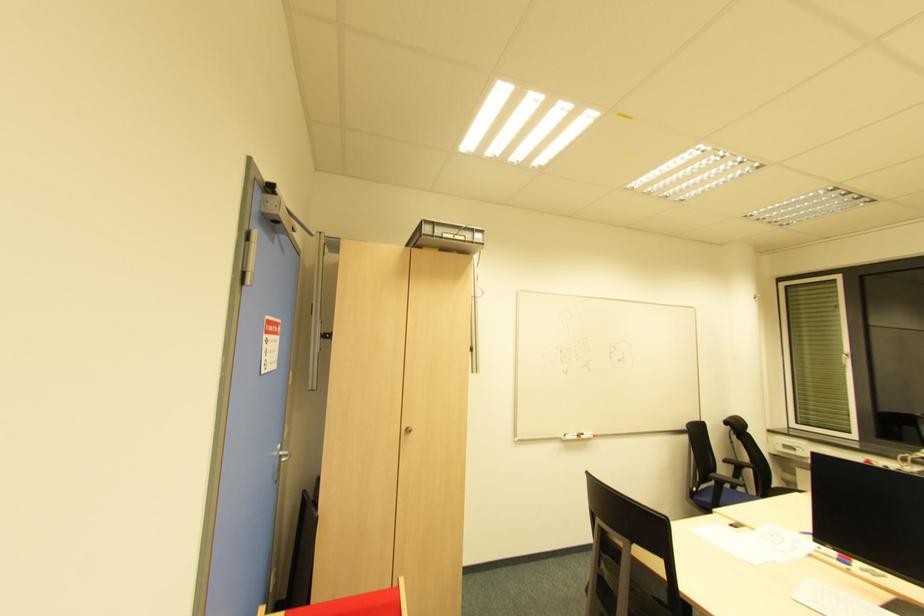
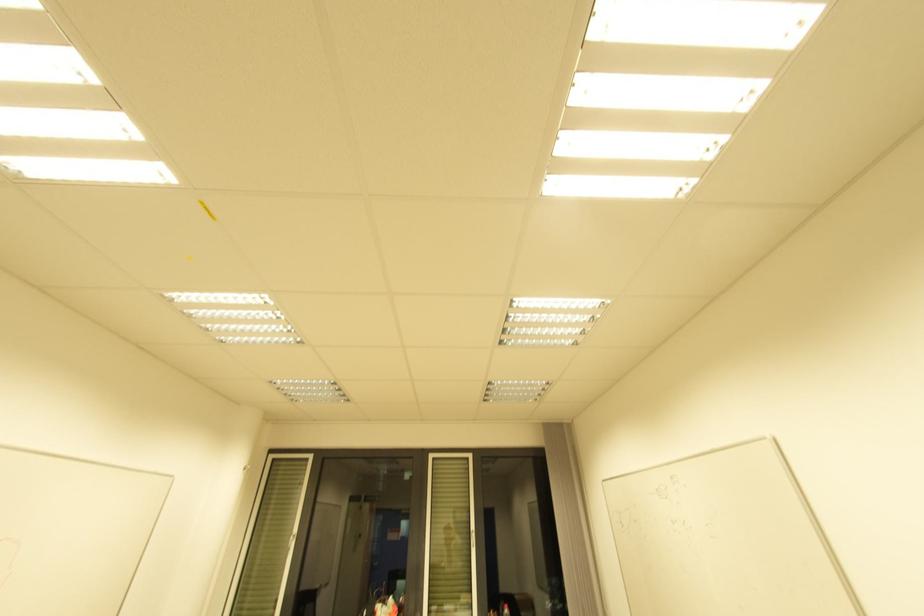
First-person continuous shooting, in which direction is the camera rotating?

The camera rotated toward right-up.